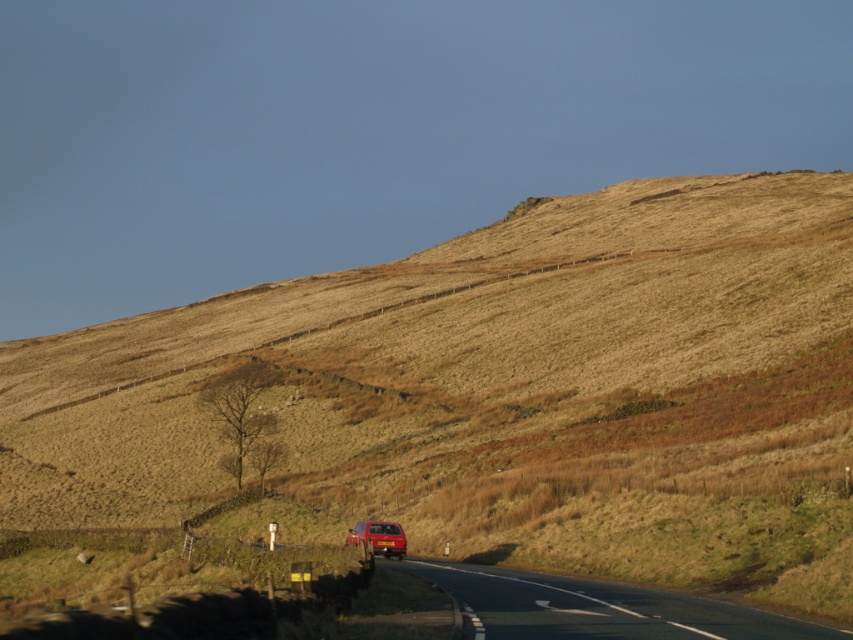
Question: Which object appears closest to the camera in this image?

Choices:
 (A) matte red car at center
 (B) black asphalt road at lower center

Answer: (B)

Question: Does black asphalt road at lower center appear over matte red car at center?

Choices:
 (A) no
 (B) yes

Answer: (B)

Question: From the image, what is the correct spatial relationship of black asphalt road at lower center in relation to matte red car at center?

Choices:
 (A) right
 (B) left

Answer: (A)

Question: In this image, where is black asphalt road at lower center located relative to matte red car at center?

Choices:
 (A) below
 (B) above

Answer: (B)